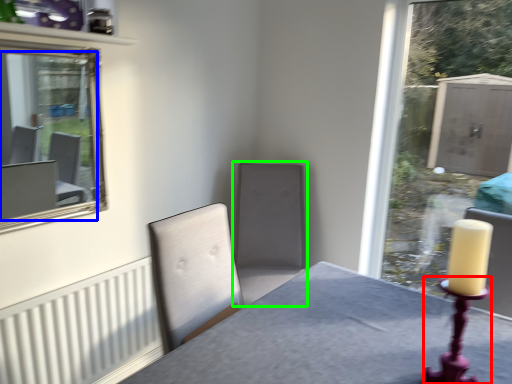
Question: Which object is positioned closest to candle holder (highlighted by a red box)? Select from mirror (highlighted by a blue box) and swivel chair (highlighted by a green box).

Choices:
 (A) mirror
 (B) swivel chair

Answer: (B)